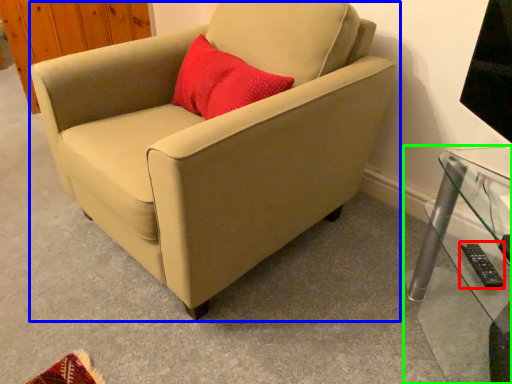
Question: Which is farther away from remote (highlighted by a red box)? chair (highlighted by a blue box) or table (highlighted by a green box)?

Choices:
 (A) chair
 (B) table

Answer: (A)